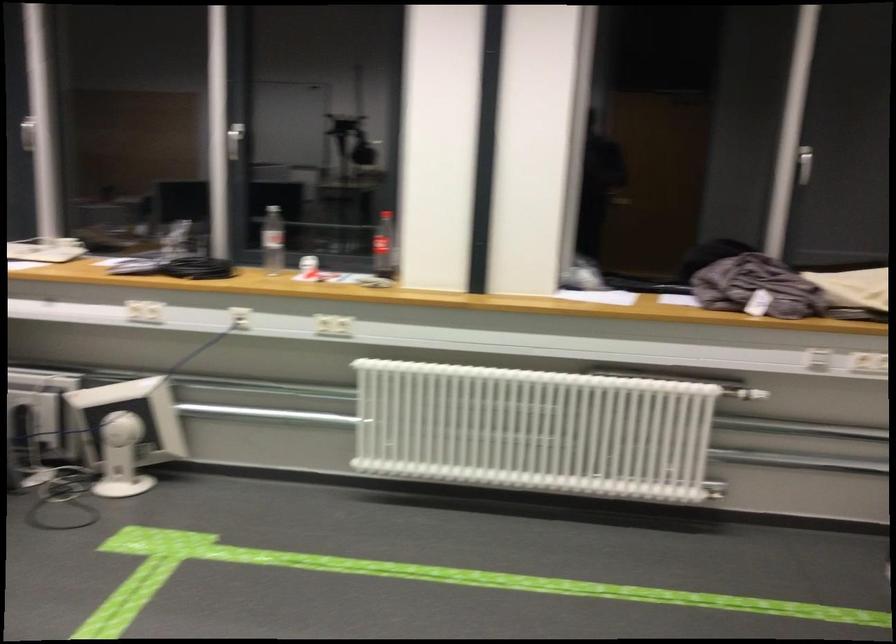
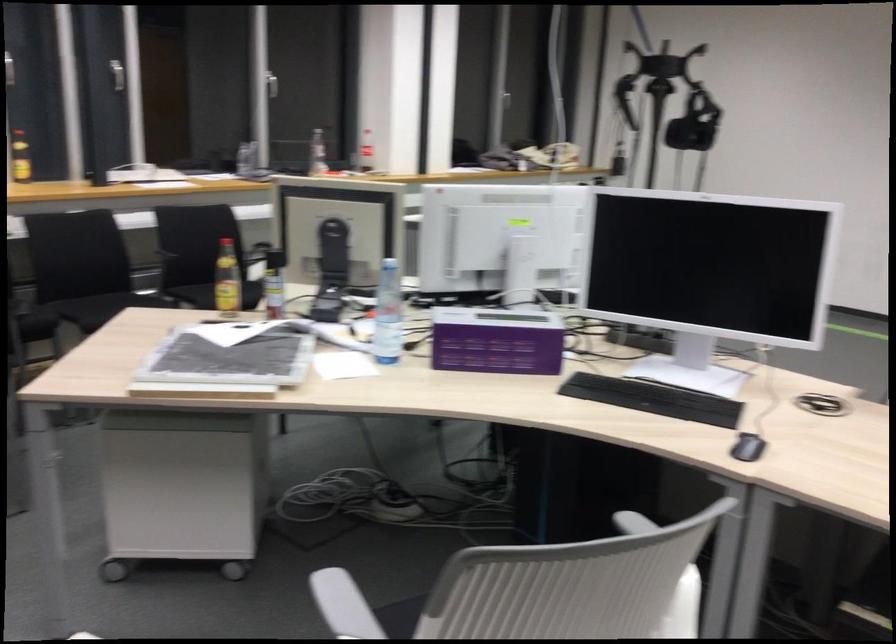
Question: I am providing you with two images of the same scene from different viewpoints. Which of the following objects are not visible in image2?

Choices:
 (A) clear water bottle
 (B) chair sitting surface
 (C) white fiber optic lamp
 (D) white computer monitor

Answer: (D)